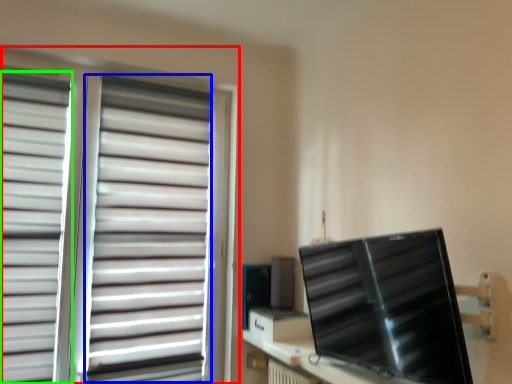
Question: Which is nearer to the window blind (highlighted by a red box)? curtain (highlighted by a blue box) or curtain (highlighted by a green box).

Choices:
 (A) curtain
 (B) curtain

Answer: (A)